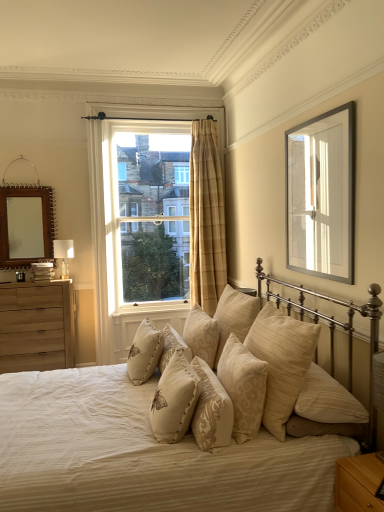
The height and width of the screenshot is (512, 384). In order to click on empty space that is ontop of light brown wood nightstand at lower right (from a real-world perspective) in this screenshot , I will do `click(367, 465)`.